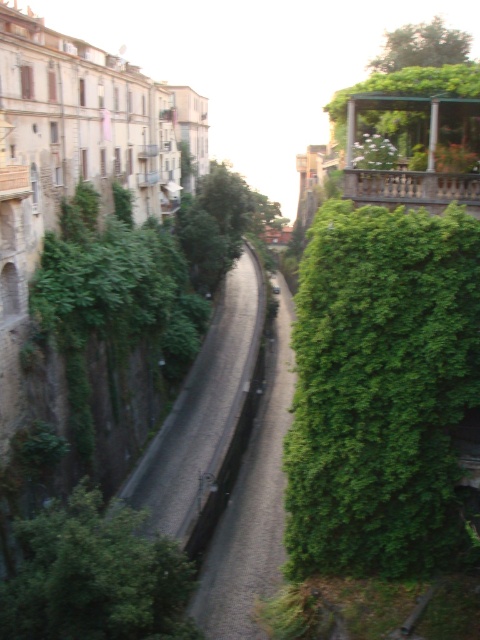
You are standing at the entrance of the narrow cobblestone street. You want to find the green leafy hedge at right. According to the coordinates provided, where should you look relative to the street?

The green leafy hedge at right is located at coordinates point (381, 390), which means it is positioned approximately 61.1 percent from the left and 79.4 percent from the bottom of the image. Since the street is narrow and the hedge is on the right side, you should look towards the right side of the street, closer to the upper part of the scene.

Consider the image. You are a tourist standing on the cobblestone street and want to take a photo that includes both the green leafy hedge at right and the green leafy tree at upper center. Given that your camera has a maximum zoom range of 50 meters, will you be able to capture both in a single frame without moving?

The green leafy hedge at right is 42.99 meters away from the green leafy tree at upper center. Since the distance between them is within the camera maximum zoom range of 50 meters, you can capture both in a single frame without moving.

You are a tourist walking along the cobblestone street and want to take a photo that includes both the green leafy hedge at lower left and the green leafy tree at upper center. Based on their positions, where should you position yourself to ensure both are in the frame?

You should position yourself at a lower viewpoint so that the green leafy hedge at lower left is visible below the green leafy tree at upper center, ensuring both are within the frame.